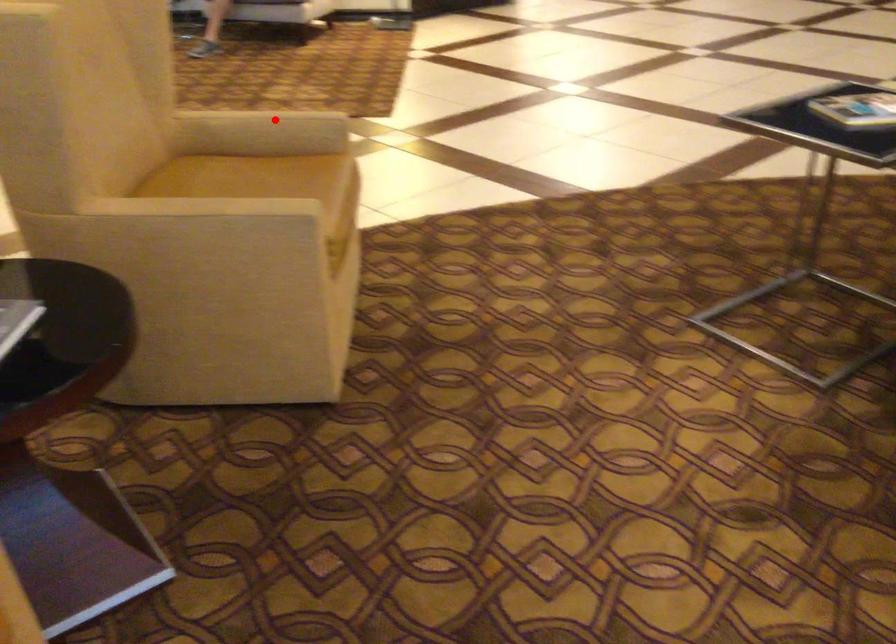
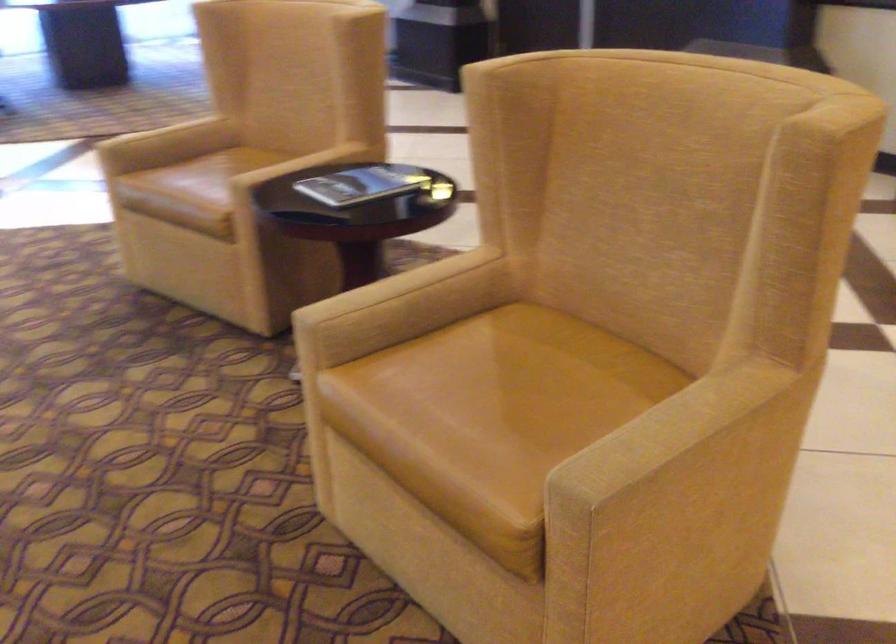
Locate, in the second image, the point that corresponds to the highlighted location in the first image.

(707, 433)